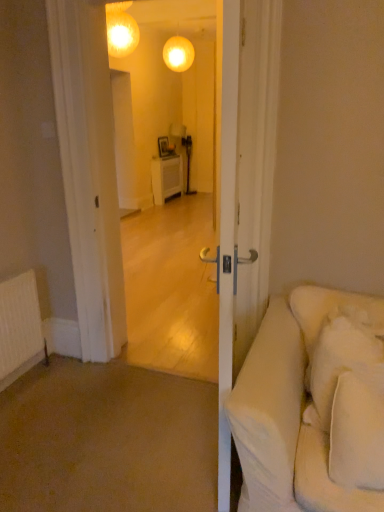
In order to face white soft pillow at right, arranged as the 2th pillow when viewed from the front, should I rotate leftwards or rightwards?

It's best to rotate right around 20.605 degrees.

The width and height of the screenshot is (384, 512). Describe the element at coordinates (358, 429) in the screenshot. I see `white soft pillow at right, the second pillow when ordered from back to front` at that location.

At what (x,y) coordinates should I click in order to perform the action: click on matte glass globe at upper center. Please return your answer as a coordinate pair (x, y). The width and height of the screenshot is (384, 512). Looking at the image, I should click on (178, 54).

Measure the distance between matte glass globe at upper center and white soft pillow at right, arranged as the 2th pillow when viewed from the front.

A distance of 18.16 feet exists between matte glass globe at upper center and white soft pillow at right, arranged as the 2th pillow when viewed from the front.

Is matte glass globe at upper center situated inside white soft pillow at right, arranged as the 2th pillow when viewed from the front, or outside?

matte glass globe at upper center is spatially situated outside white soft pillow at right, arranged as the 2th pillow when viewed from the front.

How many degrees apart are the facing directions of matte glass globe at upper center and white soft pillow at right, arranged as the 2th pillow when viewed from the front?

matte glass globe at upper center and white soft pillow at right, arranged as the 2th pillow when viewed from the front, are facing 161 degrees away from each other.

From a real-world perspective, which is physically below, matte glass globe at upper center or white soft pillow at right, arranged as the 2th pillow when viewed from the front?

white soft pillow at right, arranged as the 2th pillow when viewed from the front.

Is matte glass globe at upper center at the back of white soft pillow at right, which is the first pillow from front to back?

No, white soft pillow at right, which is the first pillow from front to back,'s orientation is not away from matte glass globe at upper center.

Which is further, (365, 426) or (191, 42)?

The point (191, 42) is farther.

Is white soft pillow at right, which is the first pillow from front to back, taller than matte glass globe at upper center?

Yes.

Can you confirm if white soft pillow at right, which is the first pillow from front to back, is wider than matte glass globe at upper center?

No.

Is white soft pillow at right, which is the 1th pillow from back to front, oriented towards white soft pillow at right, the second pillow when ordered from back to front?

Yes, white soft pillow at right, which is the 1th pillow from back to front, is aimed at white soft pillow at right, the second pillow when ordered from back to front.

Image resolution: width=384 pixels, height=512 pixels. Find the location of `pillow located above the white soft pillow at right, which is the first pillow from front to back (from a real-world perspective)`. pillow located above the white soft pillow at right, which is the first pillow from front to back (from a real-world perspective) is located at coordinates (341, 361).

Considering the relative positions of white soft pillow at right, which is the 1th pillow from back to front, and white soft pillow at right, the second pillow when ordered from back to front, in the image provided, is white soft pillow at right, which is the 1th pillow from back to front, to the left or to the right of white soft pillow at right, the second pillow when ordered from back to front,?

white soft pillow at right, which is the 1th pillow from back to front, is to the right of white soft pillow at right, the second pillow when ordered from back to front.

Is white soft pillow at right, arranged as the 2th pillow when viewed from the front, directly adjacent to white soft pillow at right, which is the first pillow from front to back?

white soft pillow at right, arranged as the 2th pillow when viewed from the front, and white soft pillow at right, which is the first pillow from front to back, are not in contact.

Measure the distance from white soft pillow at right, the second pillow when ordered from back to front, to white soft pillow at right, arranged as the 2th pillow when viewed from the front.

white soft pillow at right, the second pillow when ordered from back to front, is 4.83 inches from white soft pillow at right, arranged as the 2th pillow when viewed from the front.

Consider the image. Is white soft pillow at right, the second pillow when ordered from back to front, facing away from white soft pillow at right, arranged as the 2th pillow when viewed from the front?

Correct, white soft pillow at right, the second pillow when ordered from back to front, is looking away from white soft pillow at right, arranged as the 2th pillow when viewed from the front.

Based on the photo, are white soft pillow at right, the second pillow when ordered from back to front, and white soft pillow at right, which is the 1th pillow from back to front, located far from each other?

Actually, white soft pillow at right, the second pillow when ordered from back to front, and white soft pillow at right, which is the 1th pillow from back to front, are a little close together.

Which of these two, white soft pillow at right, which is the first pillow from front to back, or white soft pillow at right, which is the 1th pillow from back to front, stands shorter?

With less height is white soft pillow at right, which is the first pillow from front to back.

Is white soft pillow at right, which is the 1th pillow from back to front, looking in the opposite direction of matte glass globe at upper center?

Yes, white soft pillow at right, which is the 1th pillow from back to front,'s orientation is away from matte glass globe at upper center.

Between white soft pillow at right, which is the 1th pillow from back to front, and matte glass globe at upper center, which one has smaller size?

matte glass globe at upper center is smaller.

Are white soft pillow at right, arranged as the 2th pillow when viewed from the front, and matte glass globe at upper center far apart?

Yes, white soft pillow at right, arranged as the 2th pillow when viewed from the front, is far from matte glass globe at upper center.

From the image's perspective, which is below, white soft pillow at right, which is the 1th pillow from back to front, or matte glass globe at upper center?

white soft pillow at right, which is the 1th pillow from back to front, is shown below in the image.

From the image's perspective, is matte glass globe at upper center located above or below white soft pillow at right, the second pillow when ordered from back to front?

Based on their image positions, matte glass globe at upper center is located above white soft pillow at right, the second pillow when ordered from back to front.

Which object is positioned more to the left, matte glass globe at upper center or white soft pillow at right, the second pillow when ordered from back to front?

matte glass globe at upper center.

From a real-world perspective, is matte glass globe at upper center positioned above or below white soft pillow at right, the second pillow when ordered from back to front?

From a real-world perspective, matte glass globe at upper center is physically above white soft pillow at right, the second pillow when ordered from back to front.

Is point (166, 44) positioned after point (368, 481)?

Yes, point (166, 44) is behind point (368, 481).

Identify the location of lamp on the left side of white soft pillow at right, arranged as the 2th pillow when viewed from the front. The width and height of the screenshot is (384, 512). (178, 54).

Locate an element on the screen. The image size is (384, 512). lamp that is above the white soft pillow at right, which is the first pillow from front to back (from the image's perspective) is located at coordinates (178, 54).

Looking at the image, which one is located closer to matte glass globe at upper center, white soft pillow at right, arranged as the 2th pillow when viewed from the front, or white soft pillow at right, which is the first pillow from front to back?

The object closer to matte glass globe at upper center is white soft pillow at right, arranged as the 2th pillow when viewed from the front.

Which object lies further to the anchor point matte glass globe at upper center, white soft pillow at right, the second pillow when ordered from back to front, or white soft pillow at right, which is the 1th pillow from back to front?

Based on the image, white soft pillow at right, the second pillow when ordered from back to front, appears to be further to matte glass globe at upper center.

Estimate the real-world distances between objects in this image. Which object is closer to white soft pillow at right, which is the first pillow from front to back, white soft pillow at right, which is the 1th pillow from back to front, or matte glass globe at upper center?

Among the two, white soft pillow at right, which is the 1th pillow from back to front, is located nearer to white soft pillow at right, which is the first pillow from front to back.

When comparing their distances from white soft pillow at right, which is the 1th pillow from back to front, does matte glass globe at upper center or white soft pillow at right, the second pillow when ordered from back to front, seem closer?

white soft pillow at right, the second pillow when ordered from back to front.

Based on their spatial positions, is white soft pillow at right, which is the first pillow from front to back, or matte glass globe at upper center further from white soft pillow at right, arranged as the 2th pillow when viewed from the front?

The object further to white soft pillow at right, arranged as the 2th pillow when viewed from the front, is matte glass globe at upper center.

Based on their spatial positions, is matte glass globe at upper center or white soft pillow at right, which is the 1th pillow from back to front, closer to white soft pillow at right, which is the first pillow from front to back?

white soft pillow at right, which is the 1th pillow from back to front, is positioned closer to the anchor white soft pillow at right, which is the first pillow from front to back.

At what (x,y) coordinates should I click in order to perform the action: click on pillow between white soft pillow at right, which is the first pillow from front to back, and matte glass globe at upper center, along the z-axis. Please return your answer as a coordinate pair (x, y). The width and height of the screenshot is (384, 512). Looking at the image, I should click on (341, 361).